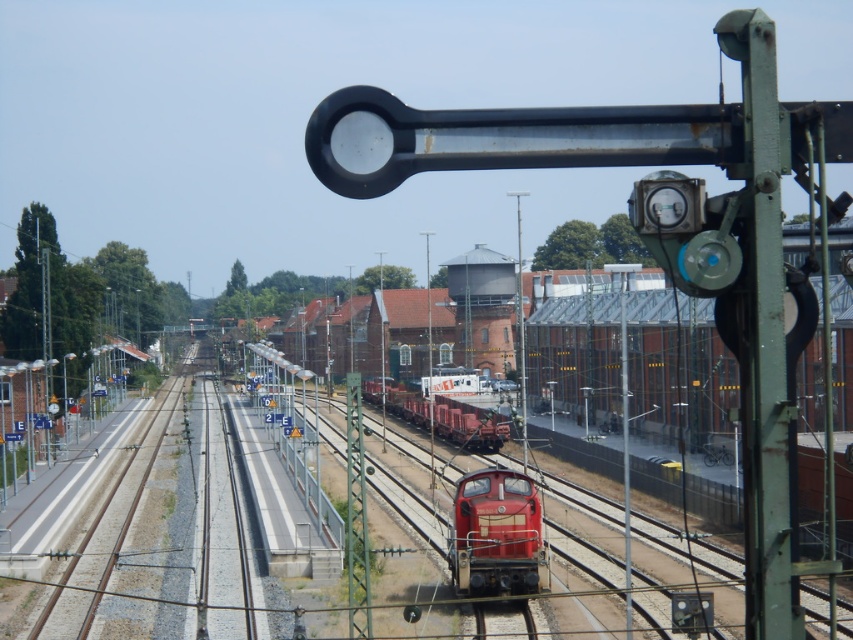
Who is positioned more to the left, shiny red locomotive at center or matte red train at center?

matte red train at center is more to the left.

Does shiny red locomotive at center have a smaller size compared to matte red train at center?

Correct, shiny red locomotive at center occupies less space than matte red train at center.

Locate an element on the screen. shiny red locomotive at center is located at coordinates (497, 536).